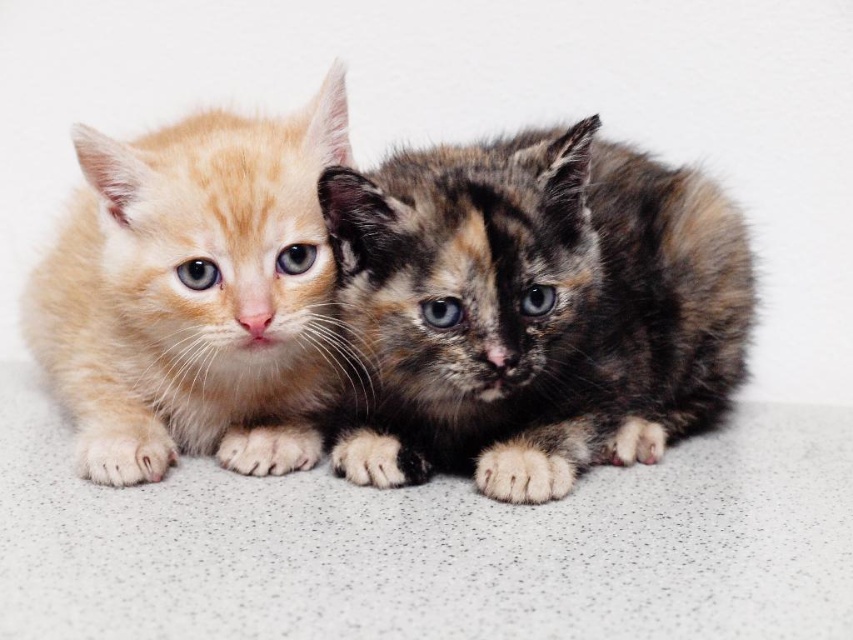
Is calico fur kitten at center to the right of matte orange kitten at left from the viewer's perspective?

Yes, calico fur kitten at center is to the right of matte orange kitten at left.

Does point (556, 429) lie behind point (329, 97)?

Yes, point (556, 429) is farther from viewer.

Image resolution: width=853 pixels, height=640 pixels. What do you see at coordinates (532, 308) in the screenshot? I see `calico fur kitten at center` at bounding box center [532, 308].

You are a GUI agent. You are given a task and a screenshot of the screen. Output one action in this format:
    pyautogui.click(x=<x>, y=<y>)
    Task: Click on the calico fur kitten at center
    
    Given the screenshot: What is the action you would take?
    pyautogui.click(x=532, y=308)